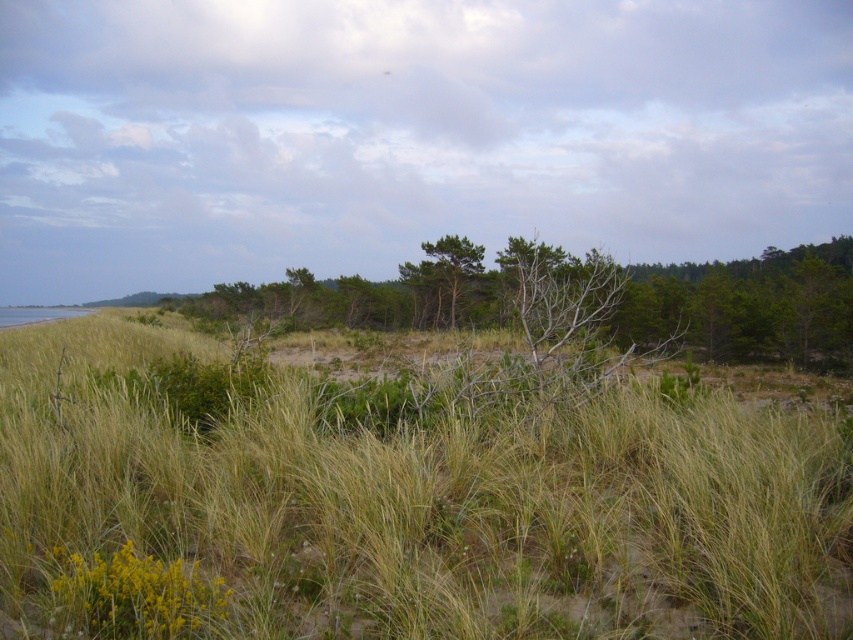
You are standing in the coastal landscape and want to take a photo of the green grassy at center and the green matte tree at center. Which object should you focus on first if you want to capture both in a single frame without moving the camera?

You should focus on the green grassy at center first because it is located below the green matte tree at center, so adjusting the camera to include both might require ensuring the lower object is in focus while framing the upper one.

You are a landscape photographer planning to capture the scene. You want to ensure that both the green grassy at center and the green matte tree at center are clearly visible in your shot. Based on their sizes, which object should you prioritize framing closer to the center of the photo to ensure it doesn

The green matte tree at center should be prioritized closer to the center of the photo because it occupies more space than the green grassy at center, making it a more dominant feature in the scene.

You are standing at the edge of the coastal landscape and want to walk towards the green grassy at center and the green matte tree at center. Which one will you reach first?

The green grassy at center is 35.87 meters away from the green matte tree at center. Since you are starting from the edge of the coastal landscape, you would reach whichever is closer first. However, the description only states the distance between them, not their positions relative to your starting point. Without knowing their exact locations relative to your position, it is impossible to determine which you will reach first.